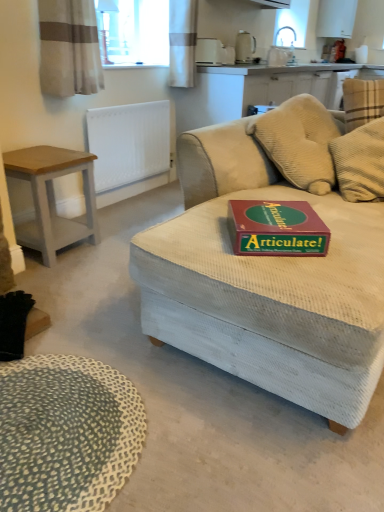
Where is `free space above light gray wood side table at left (from a real-world perspective)`? The image size is (384, 512). free space above light gray wood side table at left (from a real-world perspective) is located at coordinates (43, 158).